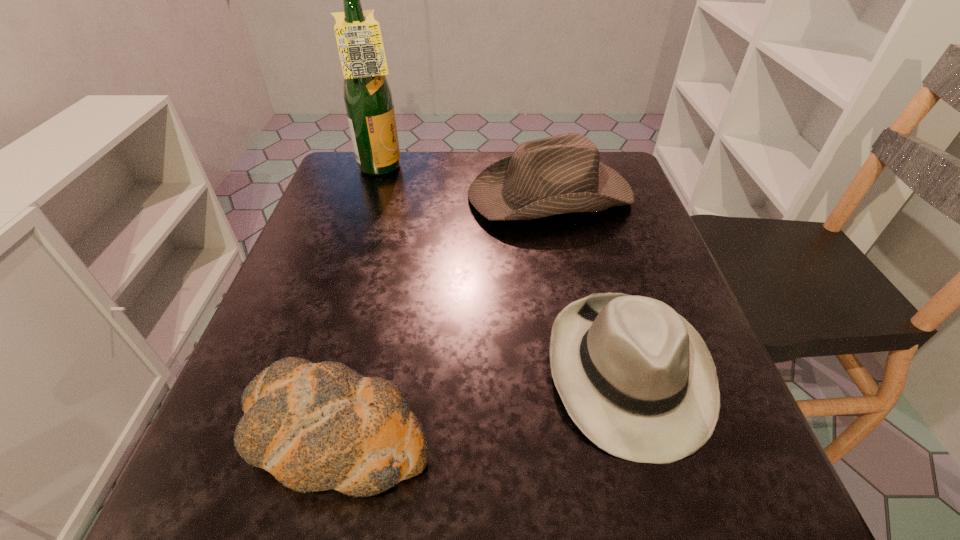
Locate an element on the screen. free space between the farther fedora and the bread is located at coordinates (442, 315).

Identify the location of vacant point located between the liquor and the nearer fedora. (505, 270).

Identify which object is located as the third nearest to the shorter fedora. Please provide its 2D coordinates. Your answer should be formatted as a tuple, i.e. [(x, y)], where the tuple contains the x and y coordinates of a point satisfying the conditions above.

[(368, 99)]

Point out which object is positioned as the second nearest to the nearer fedora. Please provide its 2D coordinates. Your answer should be formatted as a tuple, i.e. [(x, y)], where the tuple contains the x and y coordinates of a point satisfying the conditions above.

[(561, 174)]

Image resolution: width=960 pixels, height=540 pixels. Identify the location of blank area in the image that satisfies the following two spatial constraints: 1. on the front-facing side of the tallest object; 2. on the left side of the bread. (299, 435).

This screenshot has height=540, width=960. What are the coordinates of `free spot that satisfies the following two spatial constraints: 1. on the back side of the third shortest object; 2. on the right side of the bread` in the screenshot? It's located at (395, 194).

You are a GUI agent. You are given a task and a screenshot of the screen. Output one action in this format:
    pyautogui.click(x=<x>, y=<y>)
    Task: Click on the free location that satisfies the following two spatial constraints: 1. on the front-facing side of the bread; 2. on the left side of the liquor
    This screenshot has width=960, height=540.
    Given the screenshot: What is the action you would take?
    pyautogui.click(x=299, y=435)

You are a GUI agent. You are given a task and a screenshot of the screen. Output one action in this format:
    pyautogui.click(x=<x>, y=<y>)
    Task: Click on the free space in the image that satisfies the following two spatial constraints: 1. on the back side of the bread; 2. on the left side of the second tallest object
    The height and width of the screenshot is (540, 960).
    Given the screenshot: What is the action you would take?
    pyautogui.click(x=395, y=194)

The height and width of the screenshot is (540, 960). What are the coordinates of `free spot that satisfies the following two spatial constraints: 1. on the front-facing side of the liquor; 2. on the left side of the farther fedora` in the screenshot? It's located at (373, 194).

This screenshot has height=540, width=960. I want to click on vacant space that satisfies the following two spatial constraints: 1. on the front-facing side of the tallest object; 2. on the back side of the bread, so click(299, 435).